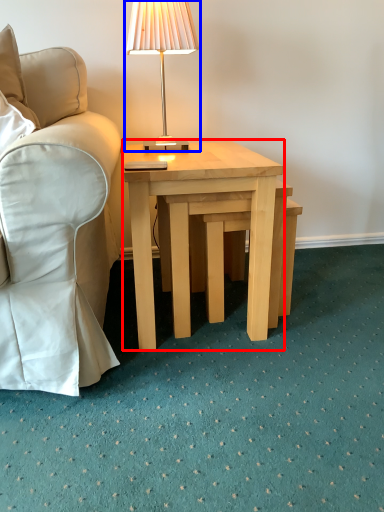
Question: Which object appears closest to the camera in this image, coffee table (highlighted by a red box) or lamp (highlighted by a blue box)?

Choices:
 (A) coffee table
 (B) lamp

Answer: (A)